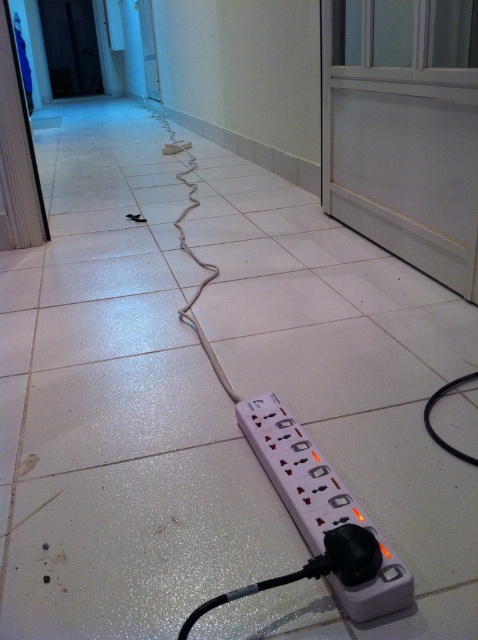
Question: Is white plastic power strip at center positioned in front of black rubber wire at lower center?

Choices:
 (A) yes
 (B) no

Answer: (A)

Question: Which object appears closest to the camera in this image?

Choices:
 (A) black rubber wire at lower center
 (B) white plastic power strip at center

Answer: (B)

Question: Can you confirm if white plastic power strip at center is positioned above black rubber wire at lower center?

Choices:
 (A) no
 (B) yes

Answer: (A)

Question: Where is white plastic power strip at center located in relation to black rubber wire at lower center in the image?

Choices:
 (A) right
 (B) left

Answer: (B)

Question: Which point appears closest to the camera in this image?

Choices:
 (A) (456, 452)
 (B) (344, 500)

Answer: (B)